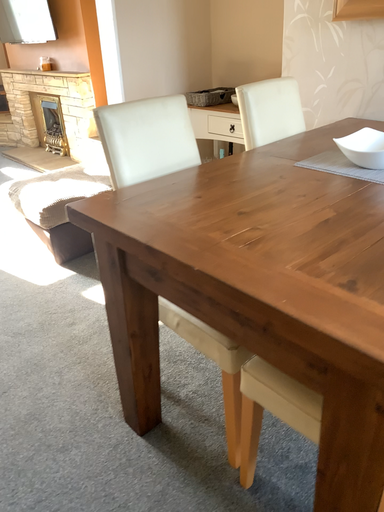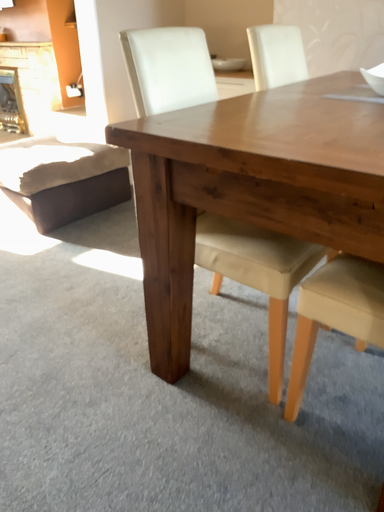
Question: Which way did the camera rotate in the video?

Choices:
 (A) rotated right
 (B) rotated left

Answer: (A)